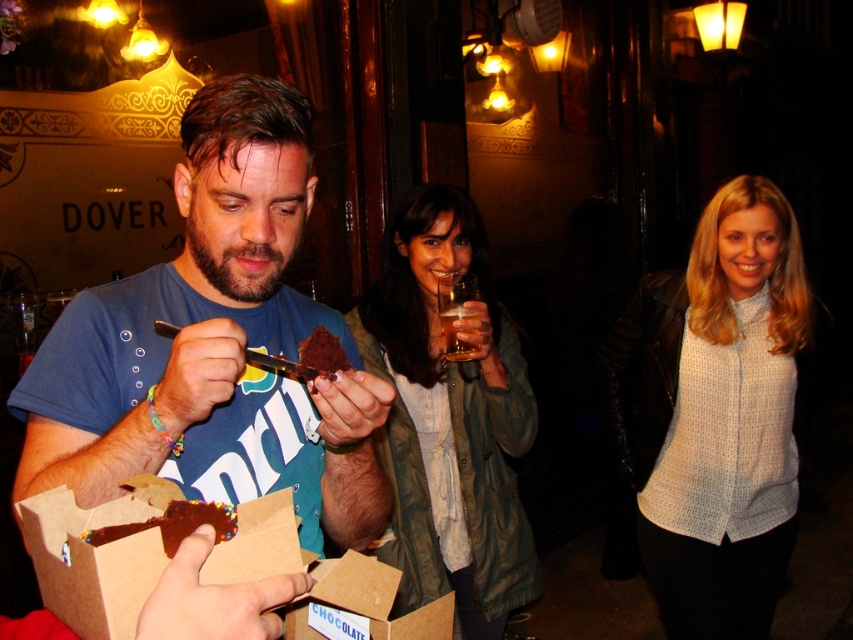
You are standing in the pub scene described. You need to locate the white textured shirt at center. Where would you look?

You should look at the coordinates point (x=718, y=413) to find the white textured shirt at center.

In the scene shown: You are standing at the position of the man holding the fork with chocolate cake. Which of the two points, point (642, 285) or point (332, 364), is closer to you?

Point (642, 285) is further to the camera than point (332, 364), so the closer point to you is point (332, 364).